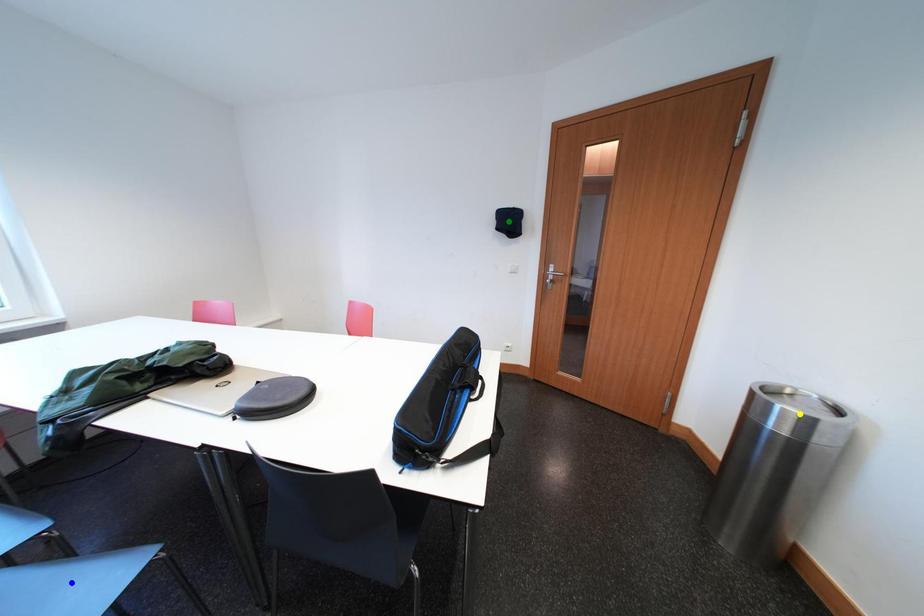
Order these from nearest to farthest:
yellow point
blue point
green point

blue point
yellow point
green point